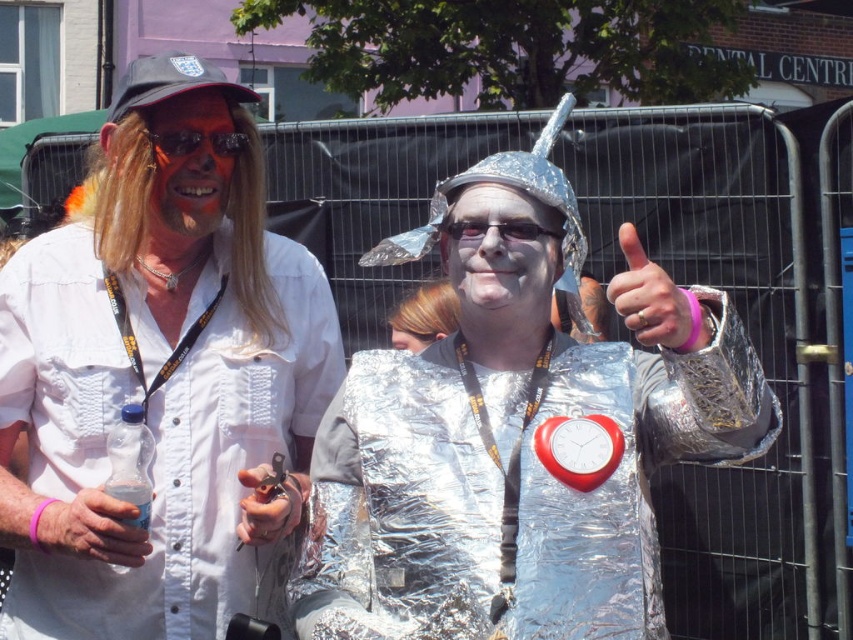
Question: Considering the real-world distances, which object is closest to the metallic silver keychain at center?

Choices:
 (A) matte white shirt at center
 (B) transparent plastic goggles at center
 (C) orange reflective goggles at upper left

Answer: (A)

Question: Does silver metallic hand at upper center have a greater width compared to orange reflective goggles at upper left?

Choices:
 (A) no
 (B) yes

Answer: (A)

Question: Is metallic silver keychain at center positioned at the back of orange reflective goggles at upper left?

Choices:
 (A) no
 (B) yes

Answer: (A)

Question: Which is nearer to the silver metallic hand at upper center?

Choices:
 (A) silver foil costume at center
 (B) white foil face at center

Answer: (B)

Question: Does orange matte face at upper left appear on the right side of orange reflective goggles at upper left?

Choices:
 (A) yes
 (B) no

Answer: (B)

Question: Among these objects, which one is nearest to the camera?

Choices:
 (A) white foil face at center
 (B) metallic silver keychain at center
 (C) silver metallic hand at upper center

Answer: (C)